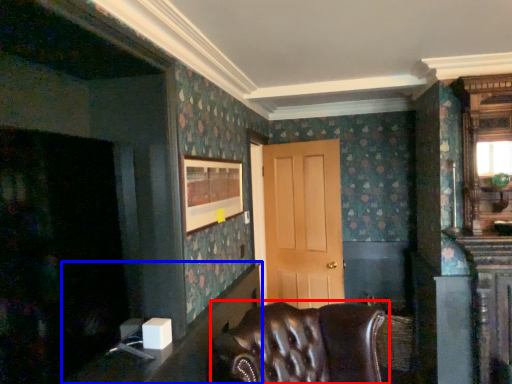
Question: Which of the following is the farthest to the observer, chair (highlighted by a red box) or table (highlighted by a blue box)?

Choices:
 (A) chair
 (B) table

Answer: (B)